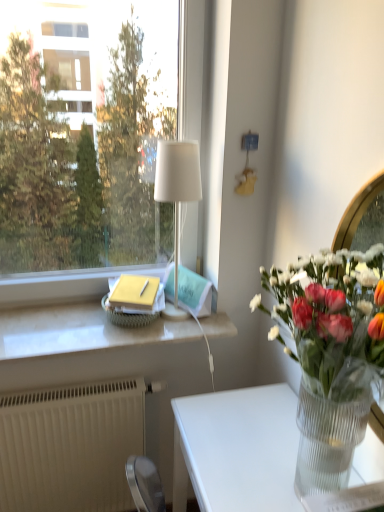
Question: Can you confirm if transparent glass window at upper left is thinner than white textured radiator at lower left?

Choices:
 (A) no
 (B) yes

Answer: (B)

Question: Can you confirm if transparent glass window at upper left is bigger than white textured radiator at lower left?

Choices:
 (A) no
 (B) yes

Answer: (B)

Question: Could white textured radiator at lower left be considered to be inside transparent glass window at upper left?

Choices:
 (A) yes
 (B) no

Answer: (B)

Question: From the image's perspective, would you say transparent glass window at upper left is shown under white textured radiator at lower left?

Choices:
 (A) no
 (B) yes

Answer: (A)

Question: Is transparent glass window at upper left oriented away from white textured radiator at lower left?

Choices:
 (A) no
 (B) yes

Answer: (A)

Question: From the image's perspective, relative to clear glass vase at right, is transparent glass window at upper left above or below?

Choices:
 (A) below
 (B) above

Answer: (B)

Question: Would you say transparent glass window at upper left is inside or outside clear glass vase at right?

Choices:
 (A) inside
 (B) outside

Answer: (B)

Question: From a real-world perspective, is transparent glass window at upper left positioned above or below clear glass vase at right?

Choices:
 (A) below
 (B) above

Answer: (B)

Question: Does point (51, 264) appear closer or farther from the camera than point (284, 293)?

Choices:
 (A) farther
 (B) closer

Answer: (A)

Question: From the image's perspective, is clear glass vase at right positioned above or below transparent glass window at upper left?

Choices:
 (A) below
 (B) above

Answer: (A)

Question: Considering the relative positions of clear glass vase at right and transparent glass window at upper left in the image provided, is clear glass vase at right to the left or to the right of transparent glass window at upper left?

Choices:
 (A) left
 (B) right

Answer: (B)

Question: Do you think clear glass vase at right is within transparent glass window at upper left, or outside of it?

Choices:
 (A) inside
 (B) outside

Answer: (B)

Question: Is clear glass vase at right bigger or smaller than transparent glass window at upper left?

Choices:
 (A) big
 (B) small

Answer: (B)

Question: Considering the positions of white marble window sill at center and transparent glass vase at lower right in the image, is white marble window sill at center taller or shorter than transparent glass vase at lower right?

Choices:
 (A) tall
 (B) short

Answer: (B)

Question: From the image's perspective, is white marble window sill at center located above or below transparent glass vase at lower right?

Choices:
 (A) below
 (B) above

Answer: (B)